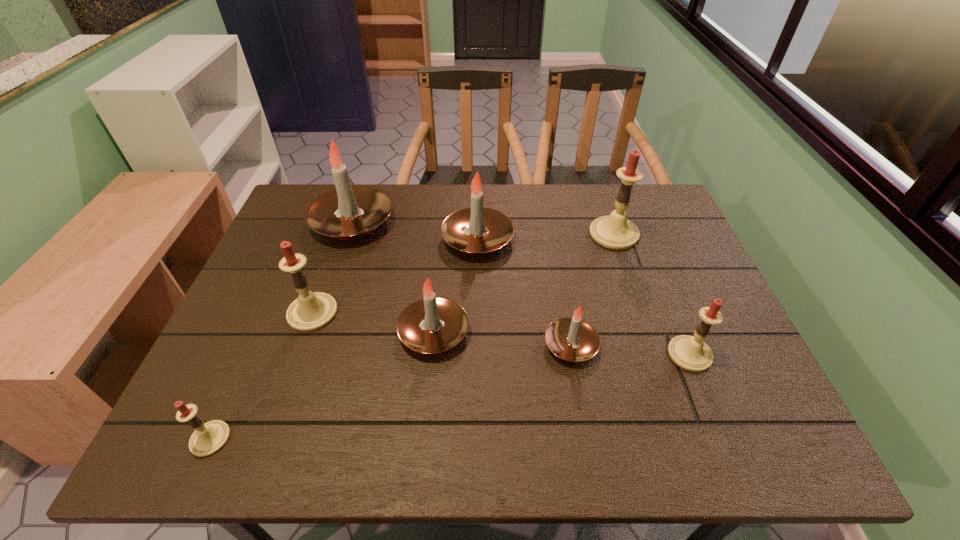
Where is `the biggest white candle`? This screenshot has width=960, height=540. the biggest white candle is located at coordinates point(349,212).

At what (x,y) coordinates should I click in order to perform the action: click on the farthest red candle. Please return your answer as a coordinate pair (x, y). The image size is (960, 540). Looking at the image, I should click on (616, 232).

What are the coordinates of `the second biggest white candle` in the screenshot? It's located at (477, 230).

The image size is (960, 540). Find the location of `the third red candle from right to left`. the third red candle from right to left is located at coordinates (311, 311).

Where is `the second biggest red candle`? the second biggest red candle is located at coordinates (311, 311).

Find the location of `the second nearest red candle`. the second nearest red candle is located at coordinates (689, 352).

Where is `the second smallest white candle`? Image resolution: width=960 pixels, height=540 pixels. the second smallest white candle is located at coordinates (433, 324).

This screenshot has width=960, height=540. I want to click on the sixth candle from left to right, so click(572, 339).

Identify the location of the third object from right to left. The width and height of the screenshot is (960, 540). (572, 339).

What are the coordinates of `the nearest object` in the screenshot? It's located at (208, 438).